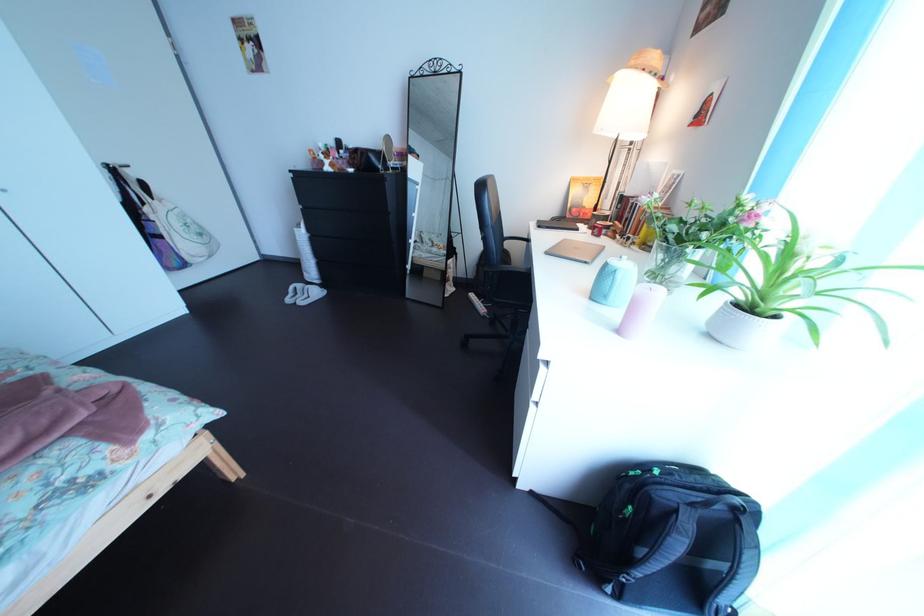
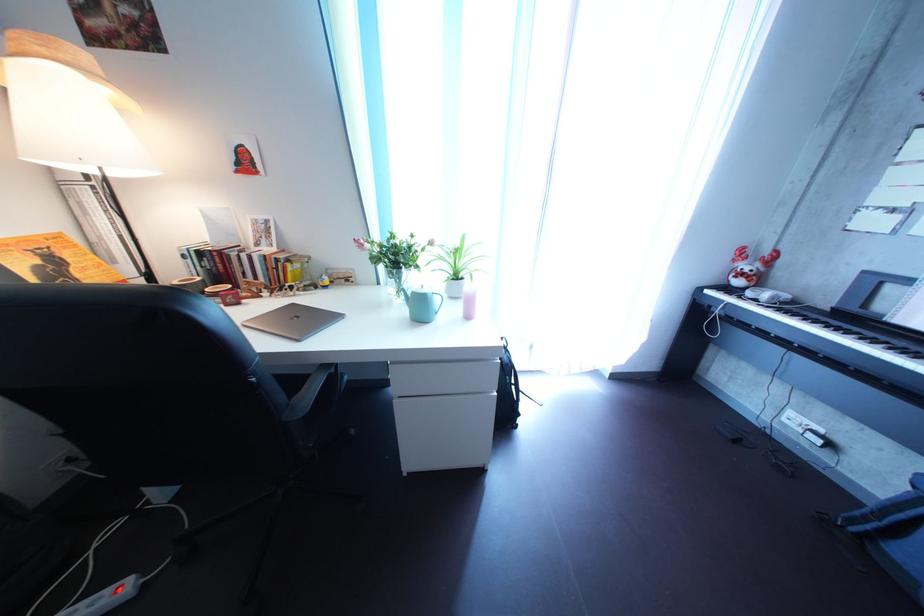
How did the camera likely rotate?

The rotation direction of the camera is right-down.